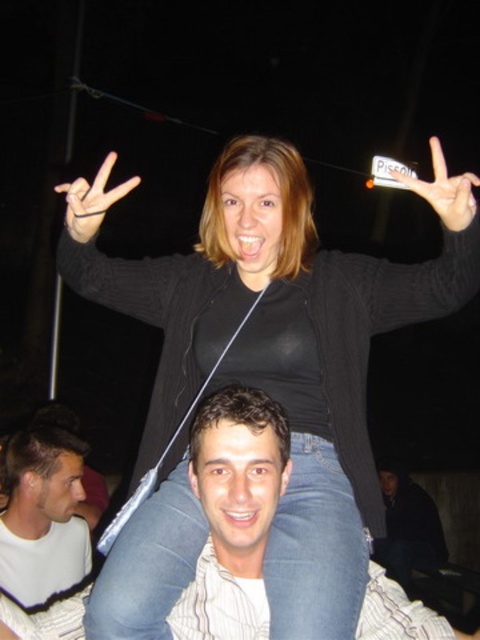
Question: Among these objects, which one is farthest from the camera?

Choices:
 (A) black sweater at center
 (B) white matte shirt at lower left
 (C) black rubber band at upper left

Answer: (B)

Question: Considering the relative positions of black sweater at center and white matte sign at upper center in the image provided, where is black sweater at center located with respect to white matte sign at upper center?

Choices:
 (A) below
 (B) above

Answer: (A)

Question: Based on their relative distances, which object is farther from the white matte shirt at lower left?

Choices:
 (A) black sweater at center
 (B) white matte sign at upper center

Answer: (B)

Question: Is white matte sign at upper center to the right of black rubber band at upper left from the viewer's perspective?

Choices:
 (A) yes
 (B) no

Answer: (A)

Question: Which point is closer to the camera?

Choices:
 (A) black sweater at center
 (B) white matte sign at upper center

Answer: (B)

Question: Can you confirm if dark blue jeans at lower right is positioned above black rubber band at upper left?

Choices:
 (A) yes
 (B) no

Answer: (B)